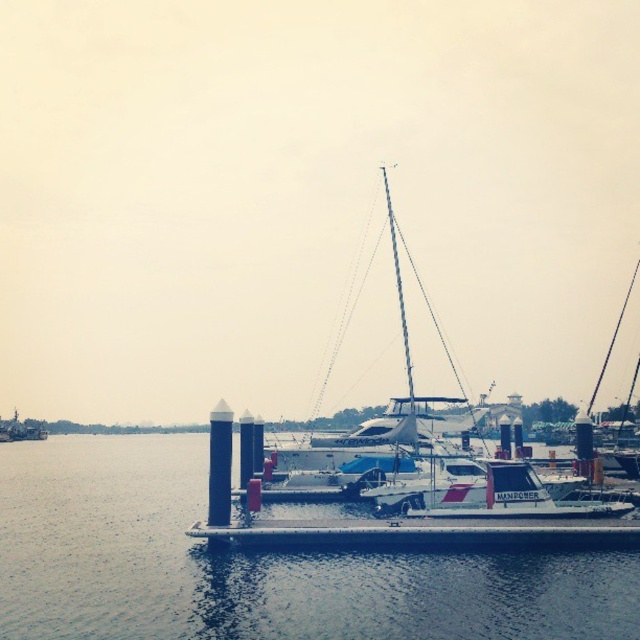
Is clear water at center bigger than metallic gray boat at lower left?

Correct, clear water at center is larger in size than metallic gray boat at lower left.

Is clear water at center taller than metallic gray boat at lower left?

Indeed, clear water at center has a greater height compared to metallic gray boat at lower left.

The image size is (640, 640). Find the location of `clear water at center`. clear water at center is located at coordinates (253, 564).